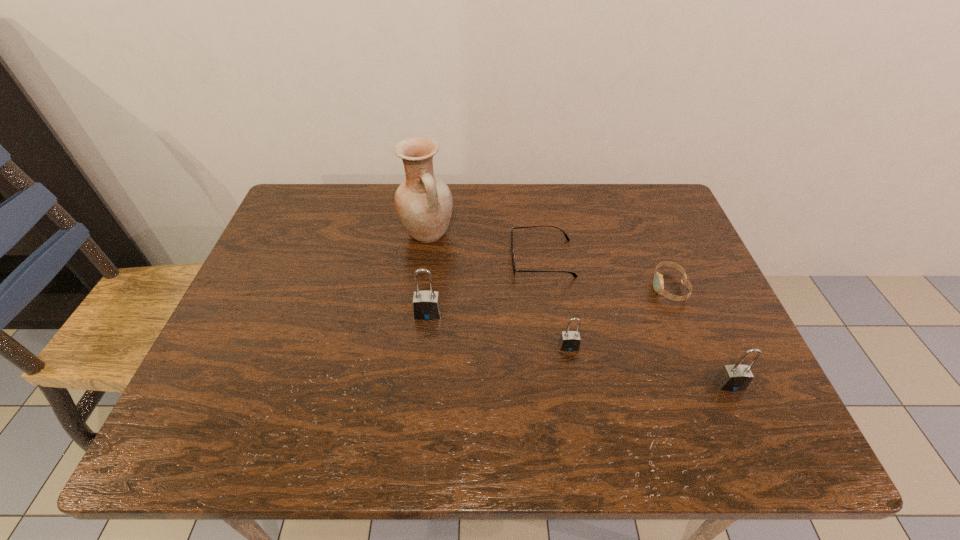
Identify which object is the third nearest to the leftmost padlock. Please provide its 2D coordinates. Your answer should be formatted as a tuple, i.e. [(x, y)], where the tuple contains the x and y coordinates of a point satisfying the conditions above.

[(569, 341)]

Select which padlock appears as the second closest to the shortest padlock. Please provide its 2D coordinates. Your answer should be formatted as a tuple, i.e. [(x, y)], where the tuple contains the x and y coordinates of a point satisfying the conditions above.

[(737, 377)]

Locate an element on the screen. This screenshot has width=960, height=540. padlock that can be found as the third closest to the tallest object is located at coordinates (737, 377).

You are a GUI agent. You are given a task and a screenshot of the screen. Output one action in this format:
    pyautogui.click(x=<x>, y=<y>)
    Task: Click on the free space that satisfies the following two spatial constraints: 1. on the face of the fifth tallest object; 2. on the shackle of the fourth tallest object
    
    Given the screenshot: What is the action you would take?
    pyautogui.click(x=693, y=347)

Where is `free location that satisfies the following two spatial constraints: 1. on the face of the second shortest object; 2. on the shackle of the second nearest object`? The height and width of the screenshot is (540, 960). free location that satisfies the following two spatial constraints: 1. on the face of the second shortest object; 2. on the shackle of the second nearest object is located at coordinates (693, 347).